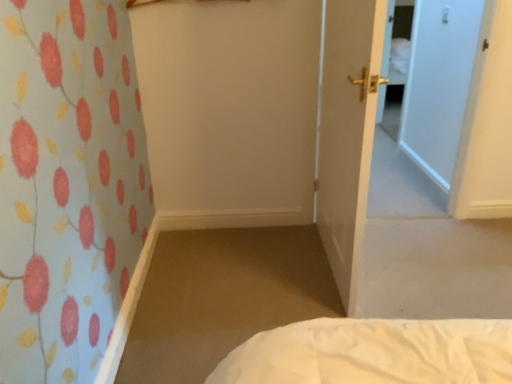
The width and height of the screenshot is (512, 384). I want to click on vacant space to the right of gold metallic door handle at center, so click(x=421, y=256).